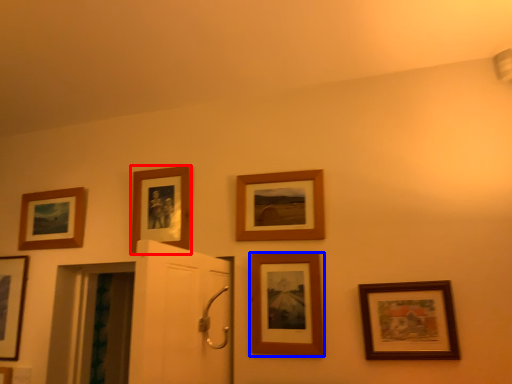
Question: Which object is further to the camera taking this photo, picture frame (highlighted by a red box) or picture frame (highlighted by a blue box)?

Choices:
 (A) picture frame
 (B) picture frame

Answer: (A)